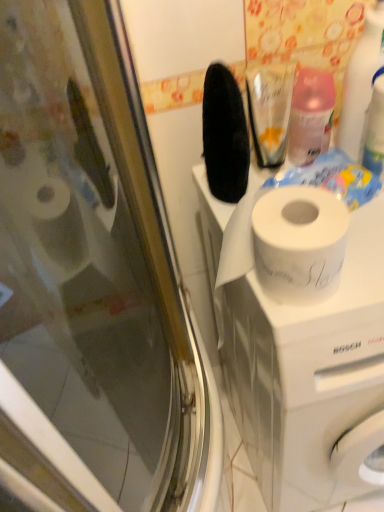
Image resolution: width=384 pixels, height=512 pixels. What do you see at coordinates (310, 116) in the screenshot?
I see `translucent plastic spray bottle at upper right, marked as the second cleaning product in a right-to-left arrangement` at bounding box center [310, 116].

Describe the element at coordinates (297, 355) in the screenshot. The width and height of the screenshot is (384, 512). I see `white matte washing machine at upper center` at that location.

Locate an element on the screen. The image size is (384, 512). white glossy spray bottle at upper right, the second cleaning product positioned from the left is located at coordinates coord(361,82).

Image resolution: width=384 pixels, height=512 pixels. I want to click on translucent plastic spray bottle at upper right, marked as the second cleaning product in a right-to-left arrangement, so click(310, 116).

Considering the positions of objects white matte washing machine at upper center and white glossy spray bottle at upper right, positioned as the 1th cleaning product in right-to-left order, in the image provided, who is more to the right, white matte washing machine at upper center or white glossy spray bottle at upper right, positioned as the 1th cleaning product in right-to-left order,?

From the viewer's perspective, white matte washing machine at upper center appears more on the right side.

Is white matte washing machine at upper center further to camera compared to white glossy spray bottle at upper right, positioned as the 1th cleaning product in right-to-left order?

No.

Is white matte washing machine at upper center not inside white glossy spray bottle at upper right, positioned as the 1th cleaning product in right-to-left order?

white matte washing machine at upper center lies outside white glossy spray bottle at upper right, positioned as the 1th cleaning product in right-to-left order,'s area.

Could you tell me if white matte washing machine at upper center is facing white glossy spray bottle at upper right, the second cleaning product positioned from the left?

No, white matte washing machine at upper center is not oriented towards white glossy spray bottle at upper right, the second cleaning product positioned from the left.

Is the surface of translucent plastic spray bottle at upper right, marked as the second cleaning product in a right-to-left arrangement, in direct contact with white glossy spray bottle at upper right, the second cleaning product positioned from the left?

Yes, translucent plastic spray bottle at upper right, marked as the second cleaning product in a right-to-left arrangement, is touching white glossy spray bottle at upper right, the second cleaning product positioned from the left.

Is translucent plastic spray bottle at upper right, marked as the second cleaning product in a right-to-left arrangement, bigger than white glossy spray bottle at upper right, positioned as the 1th cleaning product in right-to-left order?

Yes.

How distant is translucent plastic spray bottle at upper right, marked as the second cleaning product in a right-to-left arrangement, from white glossy spray bottle at upper right, the second cleaning product positioned from the left?

translucent plastic spray bottle at upper right, marked as the second cleaning product in a right-to-left arrangement, and white glossy spray bottle at upper right, the second cleaning product positioned from the left, are 2.03 inches apart.

From a real-world perspective, is translucent plastic spray bottle at upper right, acting as the 1th cleaning product starting from the left, under white glossy spray bottle at upper right, the second cleaning product positioned from the left?

Indeed, from a real-world perspective, translucent plastic spray bottle at upper right, acting as the 1th cleaning product starting from the left, is positioned beneath white glossy spray bottle at upper right, the second cleaning product positioned from the left.

How different are the orientations of white matte washing machine at upper center and translucent plastic spray bottle at upper right, marked as the second cleaning product in a right-to-left arrangement, in degrees?

The facing directions of white matte washing machine at upper center and translucent plastic spray bottle at upper right, marked as the second cleaning product in a right-to-left arrangement, are 0.588 degrees apart.

Is point (325, 337) less distant than point (302, 103)?

Yes.

Can translucent plastic spray bottle at upper right, acting as the 1th cleaning product starting from the left, be found inside white matte washing machine at upper center?

No, translucent plastic spray bottle at upper right, acting as the 1th cleaning product starting from the left, is not a part of white matte washing machine at upper center.

Is white matte washing machine at upper center oriented towards translucent plastic spray bottle at upper right, marked as the second cleaning product in a right-to-left arrangement?

No, white matte washing machine at upper center is not oriented towards translucent plastic spray bottle at upper right, marked as the second cleaning product in a right-to-left arrangement.

In the image, is white glossy spray bottle at upper right, the second cleaning product positioned from the left, on the left side or the right side of white matte washing machine at upper center?

Based on their positions, white glossy spray bottle at upper right, the second cleaning product positioned from the left, is located to the left of white matte washing machine at upper center.

Is white glossy spray bottle at upper right, positioned as the 1th cleaning product in right-to-left order, not inside white matte washing machine at upper center?

Absolutely, white glossy spray bottle at upper right, positioned as the 1th cleaning product in right-to-left order, is external to white matte washing machine at upper center.

Can you confirm if white glossy spray bottle at upper right, positioned as the 1th cleaning product in right-to-left order, is bigger than white matte washing machine at upper center?

Actually, white glossy spray bottle at upper right, positioned as the 1th cleaning product in right-to-left order, might be smaller than white matte washing machine at upper center.

From a real-world perspective, is white glossy spray bottle at upper right, the second cleaning product positioned from the left, above or below white matte washing machine at upper center?

white glossy spray bottle at upper right, the second cleaning product positioned from the left, is situated higher than white matte washing machine at upper center in the real world.

Is white glossy spray bottle at upper right, the second cleaning product positioned from the left, aimed at translucent plastic spray bottle at upper right, acting as the 1th cleaning product starting from the left?

No, white glossy spray bottle at upper right, the second cleaning product positioned from the left, does not turn towards translucent plastic spray bottle at upper right, acting as the 1th cleaning product starting from the left.

Considering the relative sizes of white glossy spray bottle at upper right, positioned as the 1th cleaning product in right-to-left order, and translucent plastic spray bottle at upper right, acting as the 1th cleaning product starting from the left, in the image provided, is white glossy spray bottle at upper right, positioned as the 1th cleaning product in right-to-left order, wider than translucent plastic spray bottle at upper right, acting as the 1th cleaning product starting from the left,?

In fact, white glossy spray bottle at upper right, positioned as the 1th cleaning product in right-to-left order, might be narrower than translucent plastic spray bottle at upper right, acting as the 1th cleaning product starting from the left.

In the scene shown: Does white glossy spray bottle at upper right, positioned as the 1th cleaning product in right-to-left order, have a larger size compared to translucent plastic spray bottle at upper right, marked as the second cleaning product in a right-to-left arrangement?

No.

Consider the image. Which is closer, (353, 53) or (333, 110)?

Point (353, 53).

This screenshot has width=384, height=512. I want to click on cleaning product that is the 1st object located above the white matte washing machine at upper center (from the image's perspective), so click(x=310, y=116).

From a real-world perspective, relative to white matte washing machine at upper center, is translucent plastic spray bottle at upper right, acting as the 1th cleaning product starting from the left, vertically above or below?

Clearly, from a real-world perspective, translucent plastic spray bottle at upper right, acting as the 1th cleaning product starting from the left, is above white matte washing machine at upper center.

How far apart are translucent plastic spray bottle at upper right, marked as the second cleaning product in a right-to-left arrangement, and white matte washing machine at upper center?

translucent plastic spray bottle at upper right, marked as the second cleaning product in a right-to-left arrangement, and white matte washing machine at upper center are 14.26 inches apart from each other.

Is translucent plastic spray bottle at upper right, acting as the 1th cleaning product starting from the left, at the left side of white matte washing machine at upper center?

Indeed, translucent plastic spray bottle at upper right, acting as the 1th cleaning product starting from the left, is positioned on the left side of white matte washing machine at upper center.

The width and height of the screenshot is (384, 512). In order to click on the 2nd cleaning product above the white matte washing machine at upper center (from the image's perspective) in this screenshot , I will do `click(361, 82)`.

Identify the location of cleaning product below the white glossy spray bottle at upper right, the second cleaning product positioned from the left (from the image's perspective). This screenshot has height=512, width=384. (310, 116).

Which object lies further to the anchor point translucent plastic spray bottle at upper right, acting as the 1th cleaning product starting from the left, white matte washing machine at upper center or white glossy spray bottle at upper right, positioned as the 1th cleaning product in right-to-left order?

Based on the image, white matte washing machine at upper center appears to be further to translucent plastic spray bottle at upper right, acting as the 1th cleaning product starting from the left.

Looking at the image, which one is located closer to white glossy spray bottle at upper right, the second cleaning product positioned from the left, white matte washing machine at upper center or translucent plastic spray bottle at upper right, marked as the second cleaning product in a right-to-left arrangement?

translucent plastic spray bottle at upper right, marked as the second cleaning product in a right-to-left arrangement, is positioned closer to the anchor white glossy spray bottle at upper right, the second cleaning product positioned from the left.

Looking at the image, which one is located further to translucent plastic spray bottle at upper right, acting as the 1th cleaning product starting from the left, white glossy spray bottle at upper right, the second cleaning product positioned from the left, or white matte washing machine at upper center?

white matte washing machine at upper center.

When comparing their distances from white matte washing machine at upper center, does translucent plastic spray bottle at upper right, acting as the 1th cleaning product starting from the left, or white glossy spray bottle at upper right, the second cleaning product positioned from the left, seem closer?

translucent plastic spray bottle at upper right, acting as the 1th cleaning product starting from the left, lies closer to white matte washing machine at upper center than the other object.

Which object lies further to the anchor point white matte washing machine at upper center, white glossy spray bottle at upper right, positioned as the 1th cleaning product in right-to-left order, or translucent plastic spray bottle at upper right, acting as the 1th cleaning product starting from the left?

The object further to white matte washing machine at upper center is white glossy spray bottle at upper right, positioned as the 1th cleaning product in right-to-left order.

Looking at the image, which one is located further to white glossy spray bottle at upper right, positioned as the 1th cleaning product in right-to-left order, translucent plastic spray bottle at upper right, marked as the second cleaning product in a right-to-left arrangement, or white matte washing machine at upper center?

white matte washing machine at upper center is positioned further to the anchor white glossy spray bottle at upper right, positioned as the 1th cleaning product in right-to-left order.

Image resolution: width=384 pixels, height=512 pixels. What are the coordinates of `cleaning product that lies between white glossy spray bottle at upper right, the second cleaning product positioned from the left, and white matte washing machine at upper center from top to bottom` in the screenshot? It's located at (310, 116).